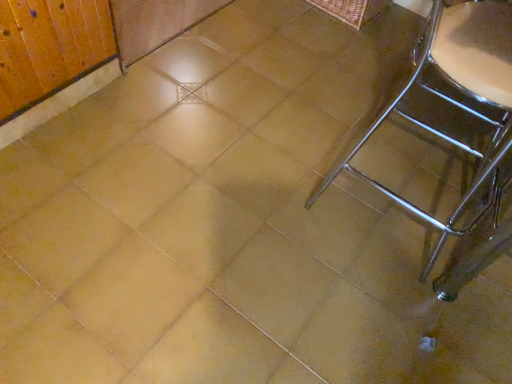
Locate an element on the screen. The width and height of the screenshot is (512, 384). free location in front of woven brown basket at upper right is located at coordinates (336, 46).